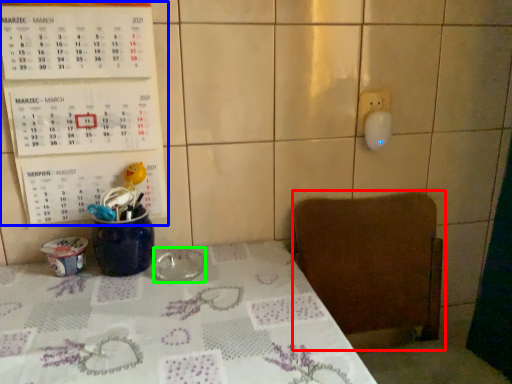
Question: Based on their relative distances, which object is nearer to chair (highlighted by a red box)? Choose from bulletin board (highlighted by a blue box) and tableware (highlighted by a green box).

Choices:
 (A) bulletin board
 (B) tableware

Answer: (B)